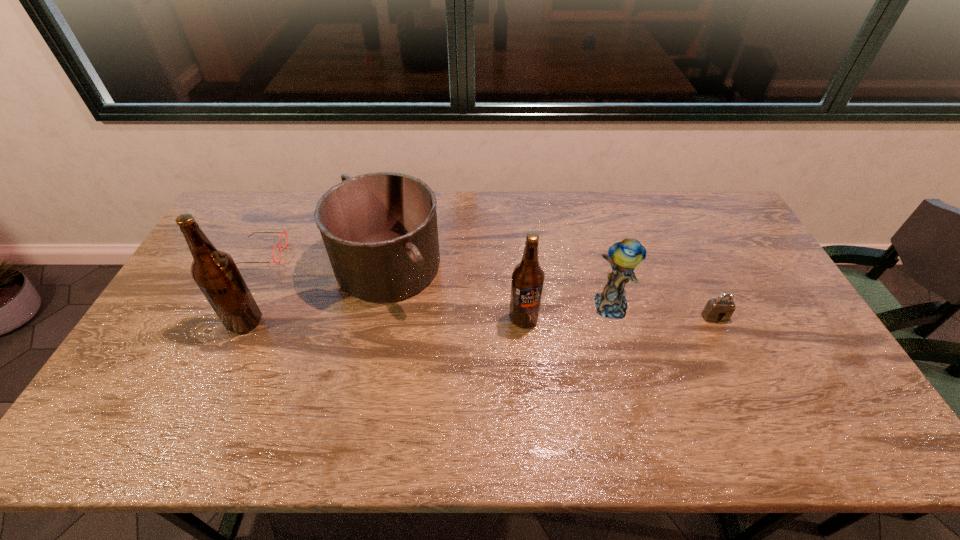
This screenshot has width=960, height=540. In order to click on free space between the padlock and the parrot in this screenshot , I will do `click(662, 312)`.

The width and height of the screenshot is (960, 540). Find the location of `unoccupied position between the fifth object from left to right and the pan`. unoccupied position between the fifth object from left to right and the pan is located at coordinates (499, 286).

Locate an element on the screen. This screenshot has width=960, height=540. vacant region between the tallest object and the padlock is located at coordinates (480, 319).

This screenshot has width=960, height=540. I want to click on free space that is in between the rightmost object and the parrot, so click(x=662, y=312).

Point out which object is positioned as the second nearest to the pan. Please provide its 2D coordinates. Your answer should be formatted as a tuple, i.e. [(x, y)], where the tuple contains the x and y coordinates of a point satisfying the conditions above.

[(282, 231)]

This screenshot has height=540, width=960. Identify the location of object that can be found as the third closest to the shorter beer bottle. (721, 308).

Locate an element on the screen. Image resolution: width=960 pixels, height=540 pixels. vacant area in the image that satisfies the following two spatial constraints: 1. on the face of the fifth object from left to right; 2. on the label of the taller beer bottle is located at coordinates (615, 322).

Image resolution: width=960 pixels, height=540 pixels. I want to click on vacant space that satisfies the following two spatial constraints: 1. at the front of the rightmost object near the keyhole; 2. on the label of the left beer bottle, so click(x=717, y=322).